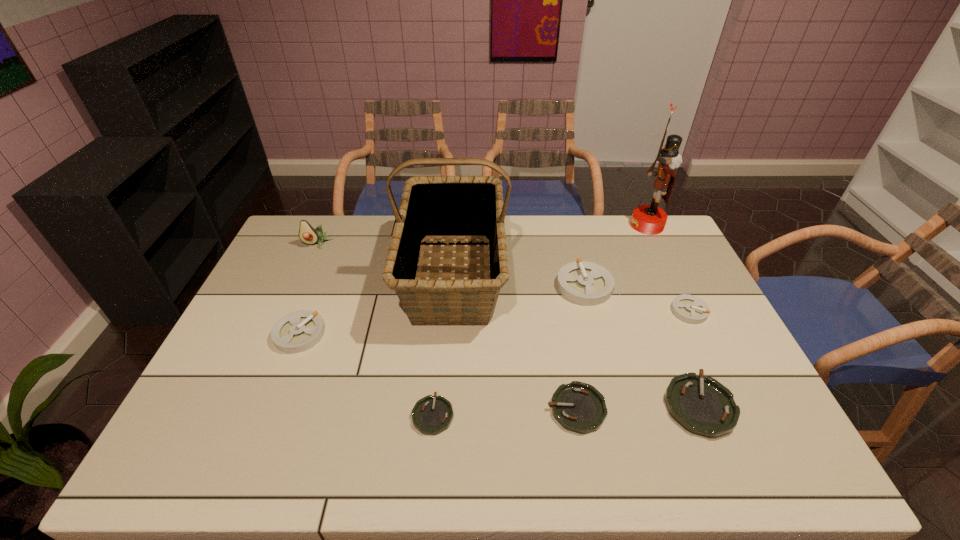
Find the location of a particular element. object at the far left corner is located at coordinates (307, 234).

This screenshot has width=960, height=540. What are the coordinates of `object that is at the far right corner` in the screenshot? It's located at (648, 219).

Find the location of a particular element. The image size is (960, 540). object situated at the near right corner is located at coordinates (703, 406).

In the image, there is a desktop. Where is `vacant region at the far edge`? This screenshot has width=960, height=540. vacant region at the far edge is located at coordinates (515, 218).

The height and width of the screenshot is (540, 960). In order to click on free space at the near edge of the desktop in this screenshot , I will do `click(517, 475)`.

Find the location of a particular element. This screenshot has height=540, width=960. free location at the left edge is located at coordinates (228, 345).

Where is `free location at the right edge of the desktop`? The image size is (960, 540). free location at the right edge of the desktop is located at coordinates (661, 301).

You are a GUI agent. You are given a task and a screenshot of the screen. Output one action in this format:
    pyautogui.click(x=<x>, y=<y>)
    Task: Click on the free space at the far left corner of the desktop
    Image resolution: width=960 pixels, height=540 pixels.
    Given the screenshot: What is the action you would take?
    pyautogui.click(x=331, y=215)

I want to click on vacant space at the near left corner of the desktop, so click(x=173, y=473).

In the image, there is a desktop. Identify the location of free space at the far right corner. The image size is (960, 540). (634, 230).